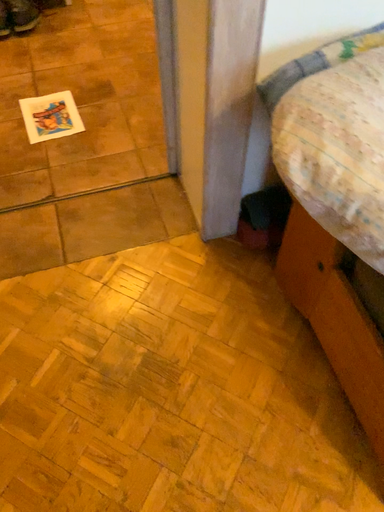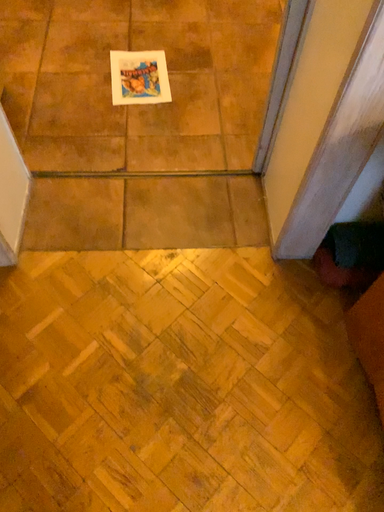
Question: How did the camera likely rotate when shooting the video?

Choices:
 (A) rotated right
 (B) rotated left

Answer: (B)